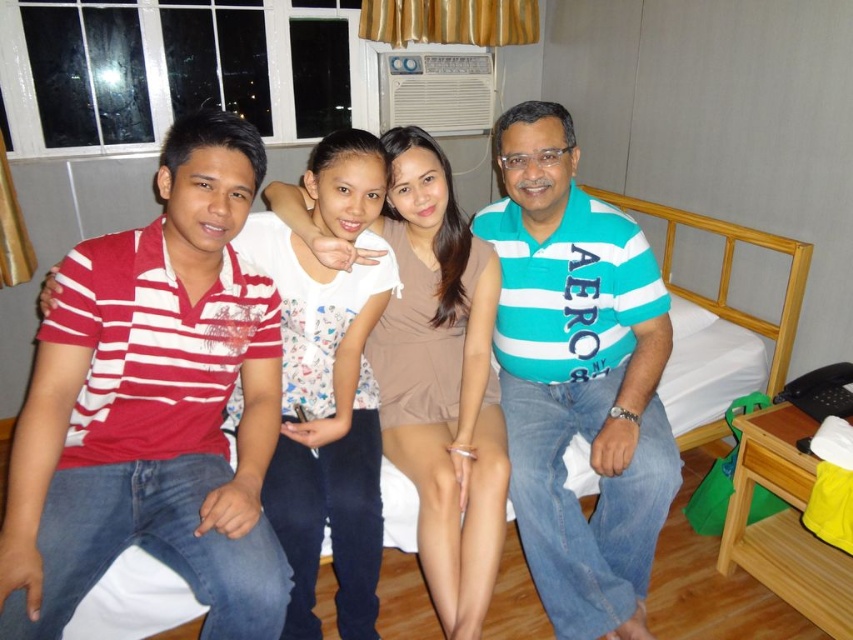
You are standing in the hotel room and see the point at coordinates [578,378]. Which clothing item is this point located on?

The point at coordinates [578,378] is located on the teal striped polo shirt at center.

You are a photographer trying to capture a clear photo of the teal striped polo shirt at center and the white fabric bed at center. Which object should you focus on first if you want to ensure both are in focus?

The photographer should focus on the white fabric bed at center first because the teal striped polo shirt at center is in front of it, so adjusting focus starting from the background and moving forward would ensure both are in focus.

You are standing in the hotel room and want to know if the point at coordinate (590, 586) is closer to you than the point at (729, 387). Can you confirm this?

Yes, the point at coordinate (590, 586) is closer to the viewer than the point at (729, 387).